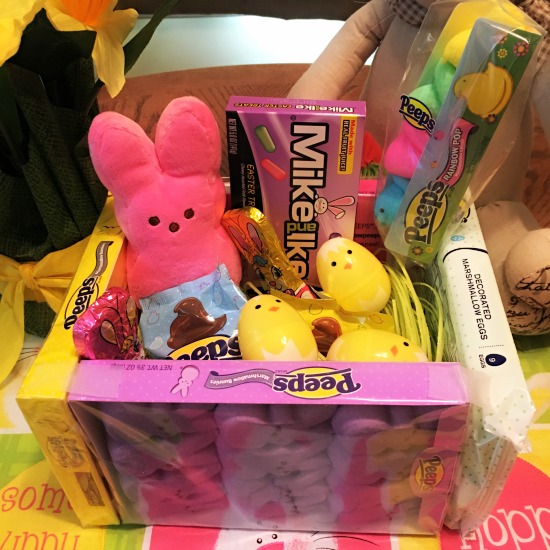
Locate an element on the screen. blanket is located at coordinates (41, 531).